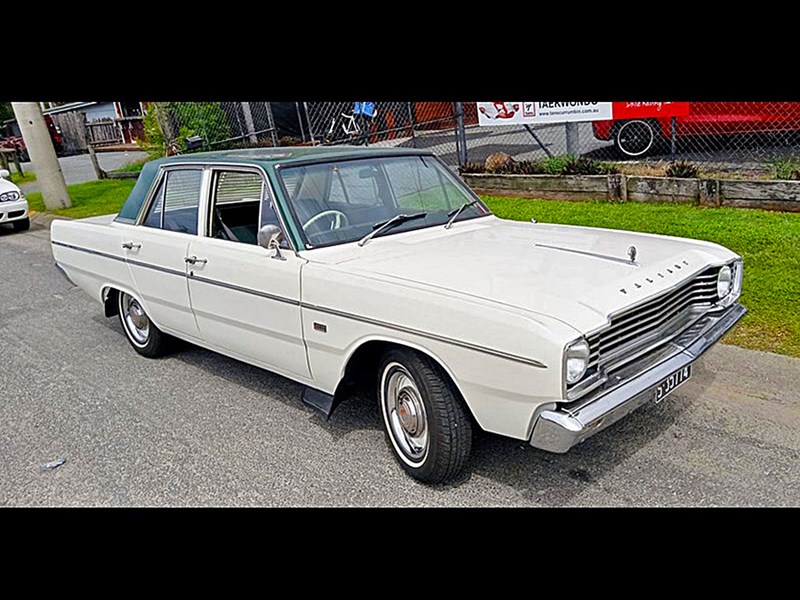
Identify the location of front door. This screenshot has height=600, width=800. (232, 295).